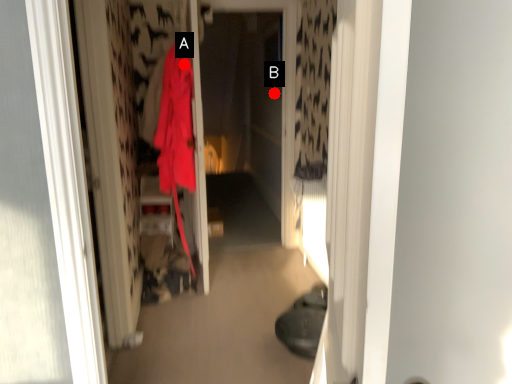
Question: Two points are circled on the image, labeled by A and B beside each circle. Which point is further to the camera?

Choices:
 (A) A is further
 (B) B is further

Answer: (B)